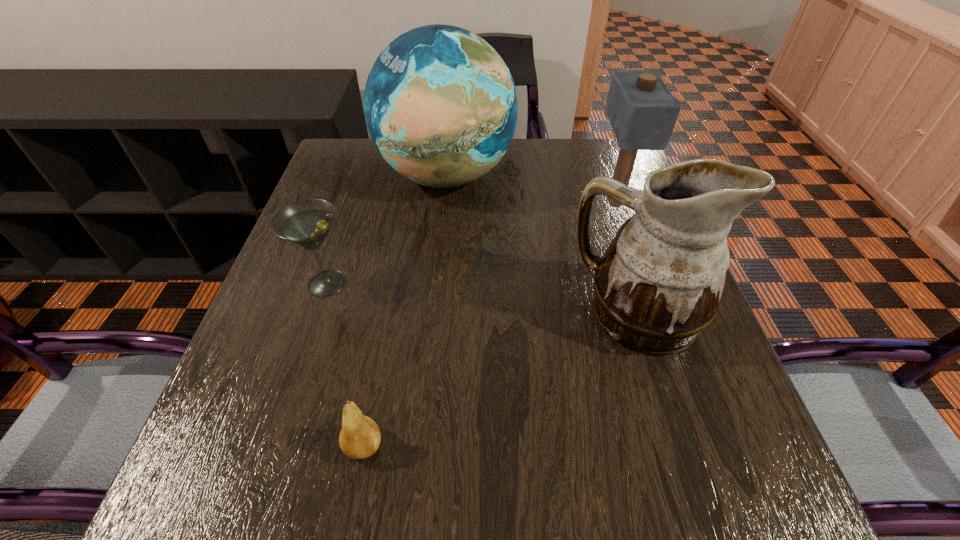
Where is `vacant space located on the left of the mallet`? vacant space located on the left of the mallet is located at coordinates (444, 202).

The image size is (960, 540). I want to click on free space located on the front of the second shortest object, so click(x=253, y=507).

The width and height of the screenshot is (960, 540). What are the coordinates of `vacant space located 0.150m on the back of the pear` in the screenshot? It's located at (381, 350).

You are a GUI agent. You are given a task and a screenshot of the screen. Output one action in this format:
    pyautogui.click(x=<x>, y=<y>)
    Task: Click on the globe that is at the far edge
    The image size is (960, 540).
    Given the screenshot: What is the action you would take?
    pyautogui.click(x=440, y=104)

Where is `mallet situated at the far edge`? mallet situated at the far edge is located at coordinates (642, 111).

Identify the location of object that is at the near edge. (360, 436).

Locate an element on the screen. The image size is (960, 540). globe at the left edge is located at coordinates (440, 104).

Identify the location of martini that is positioned at the left edge. This screenshot has width=960, height=540. (307, 222).

Locate an element on the screen. pitcher that is positioned at the right edge is located at coordinates pos(658,285).

At what (x,y) coordinates should I click in order to perform the action: click on mallet positioned at the right edge. Please return your answer as a coordinate pair (x, y). Looking at the image, I should click on (642, 111).